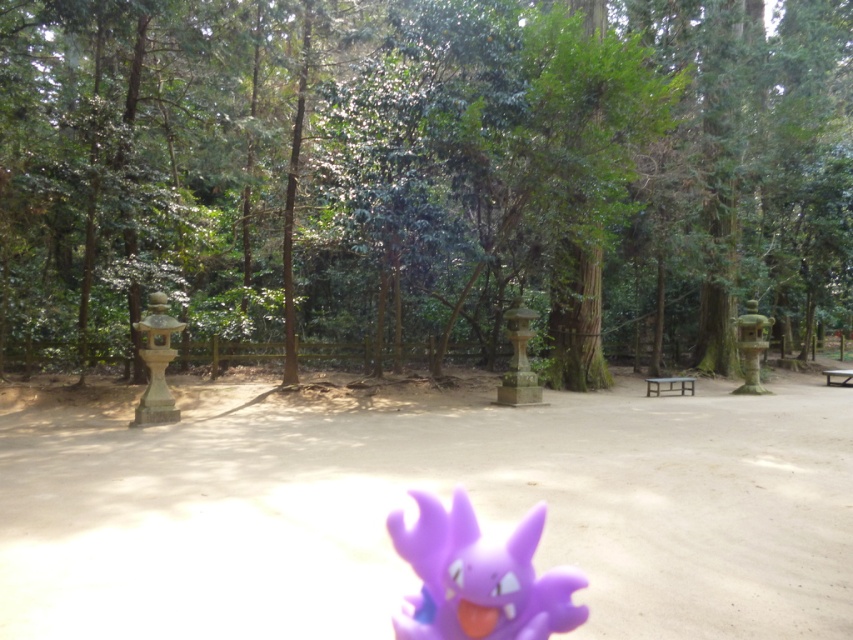
Between green matte tree at center and wooden picnic table at center, which one appears on the right side from the viewer's perspective?

wooden picnic table at center

Locate an element on the screen. The width and height of the screenshot is (853, 640). green matte tree at center is located at coordinates (422, 173).

Between point (770, 221) and point (691, 394), which one is positioned in front?

Positioned in front is point (691, 394).

You are a GUI agent. You are given a task and a screenshot of the screen. Output one action in this format:
    pyautogui.click(x=<x>, y=<y>)
    Task: Click on the green matte tree at center
    This screenshot has height=640, width=853.
    Given the screenshot: What is the action you would take?
    pyautogui.click(x=422, y=173)

Between purple rubber toy at lower center and wooden picnic table at center, which one has more height?

With more height is purple rubber toy at lower center.

Is point (465, 570) more distant than point (683, 380)?

That is False.

This screenshot has width=853, height=640. Identify the location of purple rubber toy at lower center. (479, 577).

Is matte stone lantern at right above wooden picnic table at center?

Yes, matte stone lantern at right is above wooden picnic table at center.

Which is below, matte stone lantern at right or wooden picnic table at center?

wooden picnic table at center

Does point (746, 348) come farther from viewer compared to point (651, 380)?

That is True.

The height and width of the screenshot is (640, 853). I want to click on matte stone lantern at right, so click(751, 348).